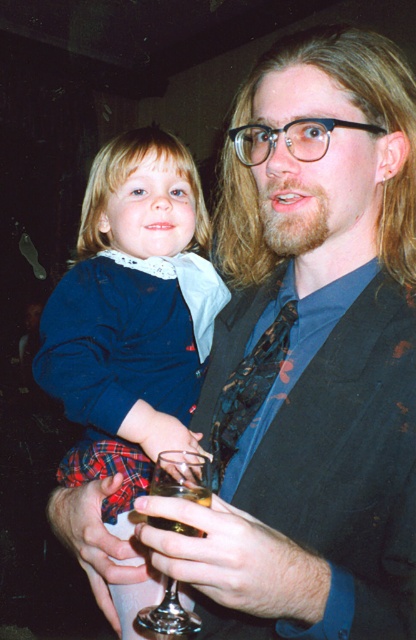
Looking at this image, you are a photographer trying to capture a candid shot of the scene described. The camera you are using has a depth of field that can focus on objects within a range of 25 to 35 inches from the lens. Is the point at coordinates point[279,330] within this focus range?

The distance of point[279,330] from the camera is 31.46 inches, which falls within the 25 to 35 inch range. Therefore, the point is within the focus range.

You are a photographer at a party and want to take a portrait of the adult wearing the shiny black tie at center and holding the clear glass wine at center. To ensure both objects are in focus, you need to know their positions relative to each other. Which object is located to the right of the other?

The shiny black tie at center is positioned on the right side of clear glass wine at center, so the shiny black tie at center is to the right of the clear glass wine at center.

From the picture: You are a photographer at the event and need to capture a clear shot of both the shiny black tie at center and the translucent glass at center. Which object should you focus on first to ensure both are in focus?

The shiny black tie at center is above the translucent glass at center, so focusing on the shiny black tie at center first would ensure both are in focus as the translucent glass at center is closer to the camera.